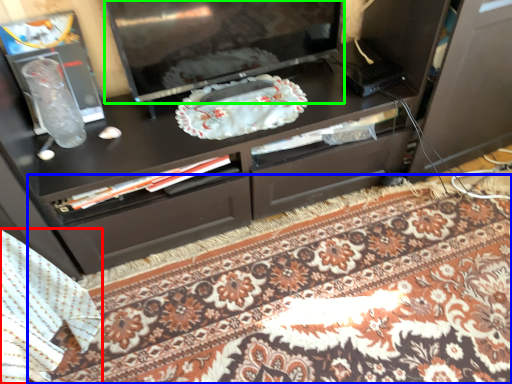
Question: Based on their relative distances, which object is farther from blanket (highlighted by a red box)? Choose from mat (highlighted by a blue box) and television (highlighted by a green box).

Choices:
 (A) mat
 (B) television

Answer: (B)